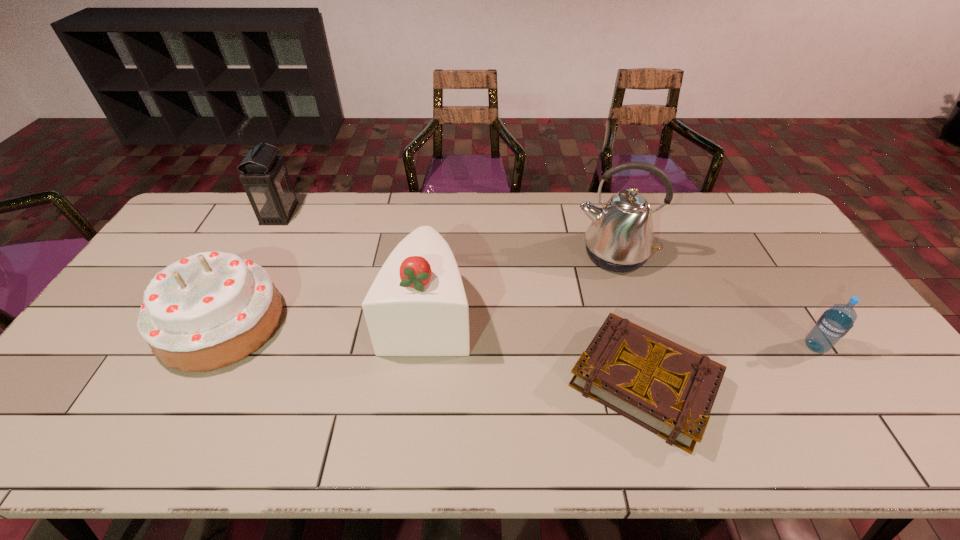
I want to click on lantern, so click(x=265, y=179).

This screenshot has width=960, height=540. What are the coordinates of `kettle` in the screenshot? It's located at (620, 238).

This screenshot has height=540, width=960. Find the location of `the taller cake`. the taller cake is located at coordinates (x=417, y=306).

The image size is (960, 540). Find the location of `the right cake`. the right cake is located at coordinates (417, 306).

The width and height of the screenshot is (960, 540). Identify the location of the third shortest object. (212, 309).

Identify the location of the shorter cake. The width and height of the screenshot is (960, 540). (212, 309).

I want to click on the rightmost object, so [834, 323].

The image size is (960, 540). Identify the location of water bottle. (834, 323).

Locate an element on the screen. This screenshot has height=540, width=960. hardback book is located at coordinates (668, 389).

Locate an element on the screen. The width and height of the screenshot is (960, 540). vacant region located 0.270m on the front-facing side of the farthest object is located at coordinates (372, 214).